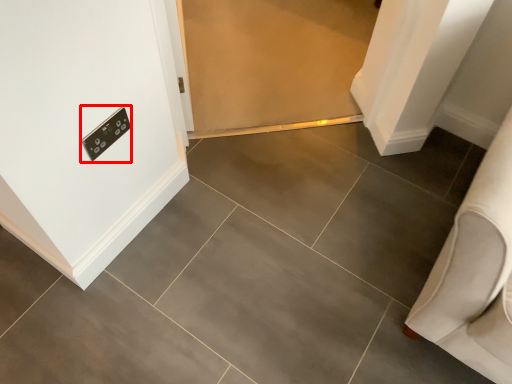
Question: Observing the image, what is the correct spatial positioning of light switch (annotated by the red box) in reference to furniture?

Choices:
 (A) right
 (B) left

Answer: (B)